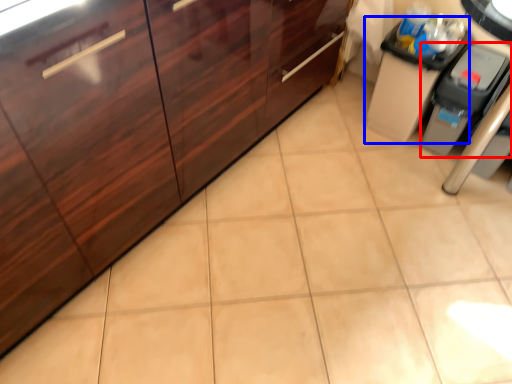
Question: Which point is further to the camera, appliance (highlighted by a red box) or cabinetry (highlighted by a blue box)?

Choices:
 (A) appliance
 (B) cabinetry

Answer: (B)